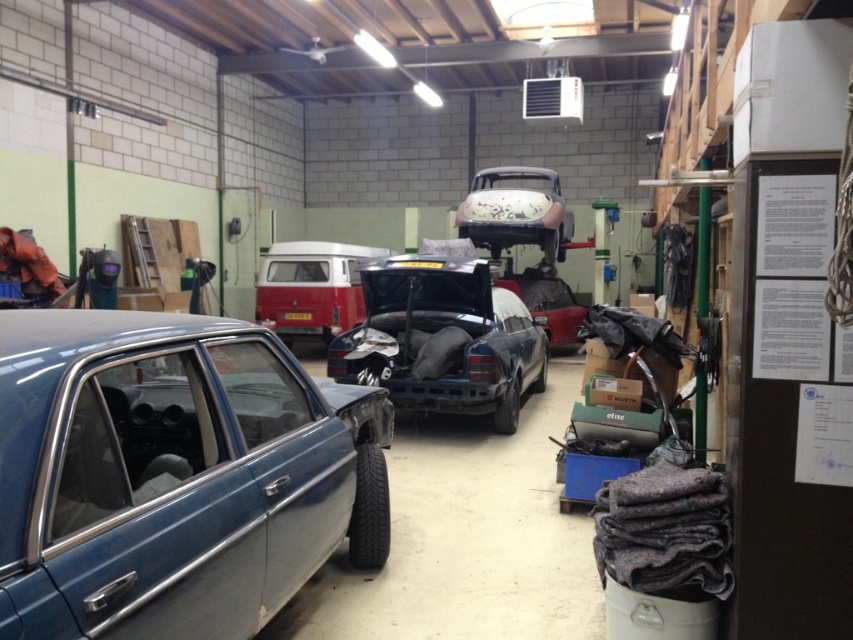
From the picture: You are a mechanic working in this garage and need to move the metallic blue car at lower left and the rusty metal car at center to make space for a new vehicle. Based on their sizes, which car would be easier to maneuver into a tighter space?

The metallic blue car at lower left has a smaller size compared to the rusty metal car at center, so it would be easier to maneuver into a tighter space.

You are standing in the garage and want to move from the point closer to you to the point further away. Which path would you take to go from the point at (264, 369) to the point at (457, 400)?

The path from point (264, 369) to point (457, 400) requires moving forward and to the right since point (264, 369) is closer to the viewer and point (457, 400) is further away.

You are a mechanic working in this garage. You need to move the rusty metal car at center and the matte white van at center out of the garage. The garage door is 2 meters wide. Can both vehicles pass through the door simultaneously side by side?

The rusty metal car at center is wider than the matte white van at center. The combined width of both vehicles would exceed the garage door width of 2 meters, so they cannot pass through simultaneously side by side.